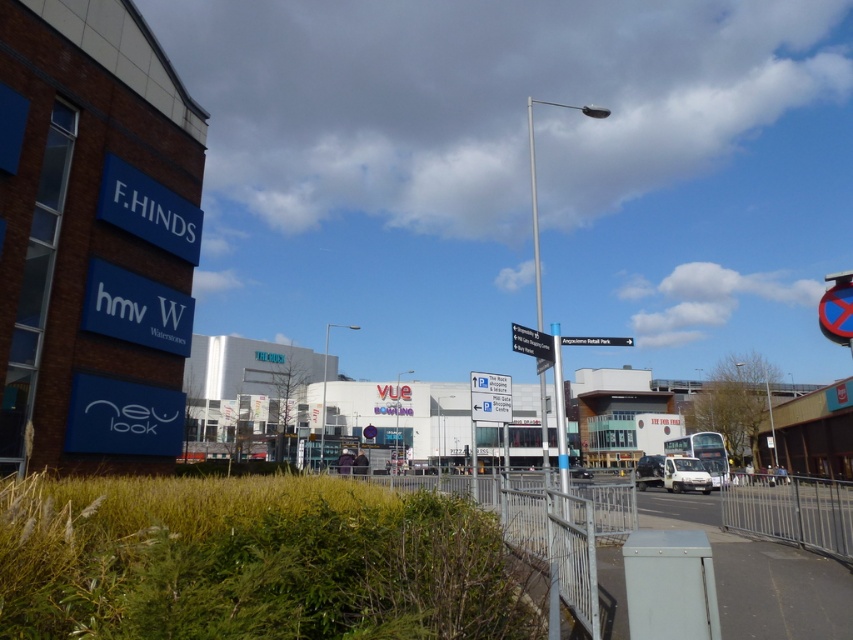
Looking at this image, is white matte van at lower right positioned behind white glossy van at center?

No, white matte van at lower right is closer to the viewer.

Between point (689, 483) and point (653, 458), which one is positioned in front?

Point (689, 483) is in front.

At what (x,y) coordinates should I click in order to perform the action: click on white matte van at lower right. Please return your answer as a coordinate pair (x, y). Looking at the image, I should click on (685, 474).

Does red plastic sign at upper right have a smaller size compared to white matte van at lower right?

Indeed, red plastic sign at upper right has a smaller size compared to white matte van at lower right.

Does point (850, 305) lie in front of point (666, 483)?

Yes, point (850, 305) is closer to viewer.

Image resolution: width=853 pixels, height=640 pixels. I want to click on red plastic sign at upper right, so click(x=836, y=310).

Locate an element on the screen. The height and width of the screenshot is (640, 853). red plastic sign at upper right is located at coordinates (836, 310).

Looking at this image, is red plastic sign at upper right taller than white glossy van at center?

Incorrect, red plastic sign at upper right's height is not larger of white glossy van at center's.

Does point (846, 276) lie behind point (651, 484)?

That is False.

Who is more distant from viewer, (848, 332) or (657, 476)?

The point (657, 476) is more distant.

Locate an element on the screen. red plastic sign at upper right is located at coordinates (836, 310).